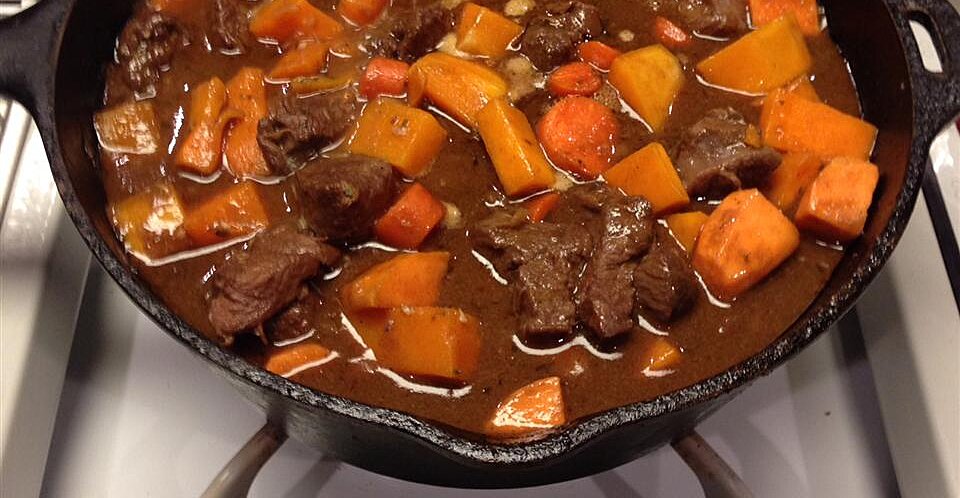
Where is `stove`? This screenshot has height=498, width=960. stove is located at coordinates (175, 426).